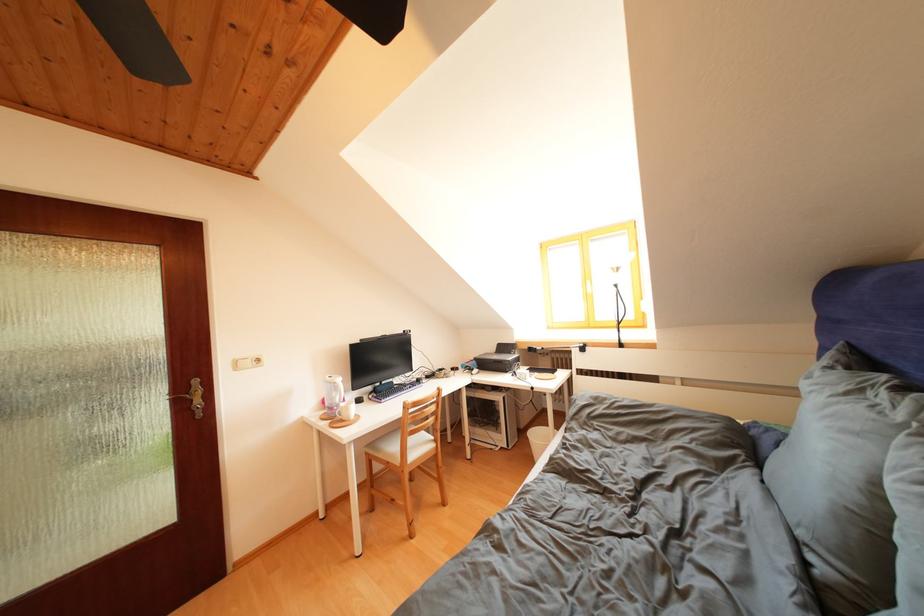
The height and width of the screenshot is (616, 924). What do you see at coordinates (416, 447) in the screenshot?
I see `the chair sitting surface` at bounding box center [416, 447].